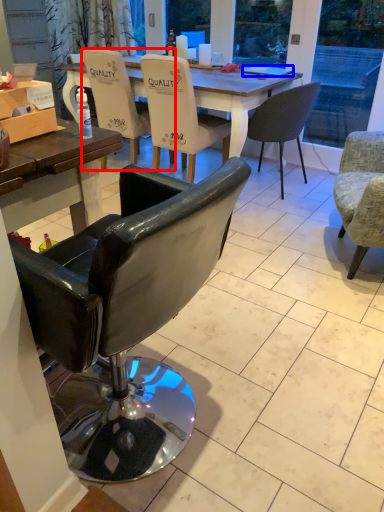
Question: Among these objects, which one is nearest to the camera, chair (highlighted by a red box) or laptop (highlighted by a blue box)?

Choices:
 (A) chair
 (B) laptop

Answer: (A)